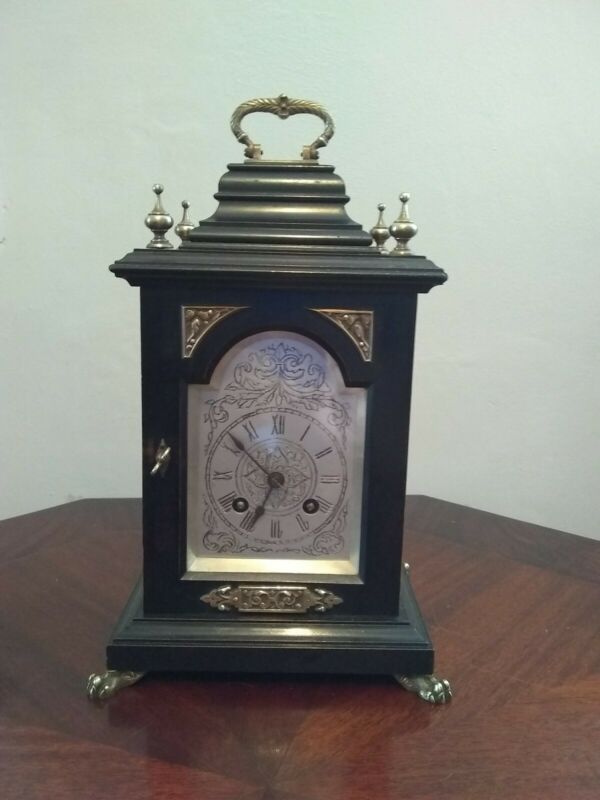
At what (x,y) coordinates should I click in order to perform the action: click on space in table to the left of clock. Please return your answer as a coordinate pair (x, y). Looking at the image, I should click on (56, 594).